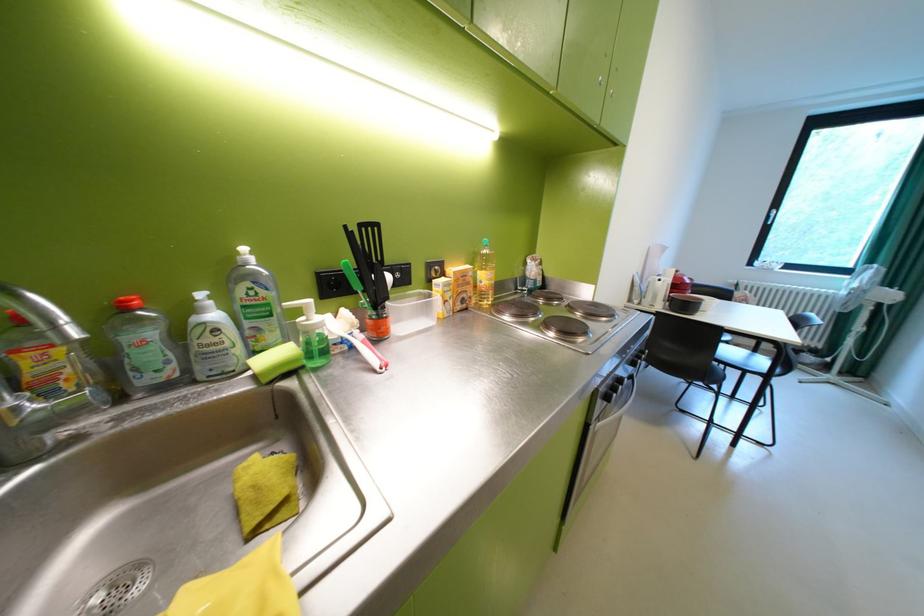
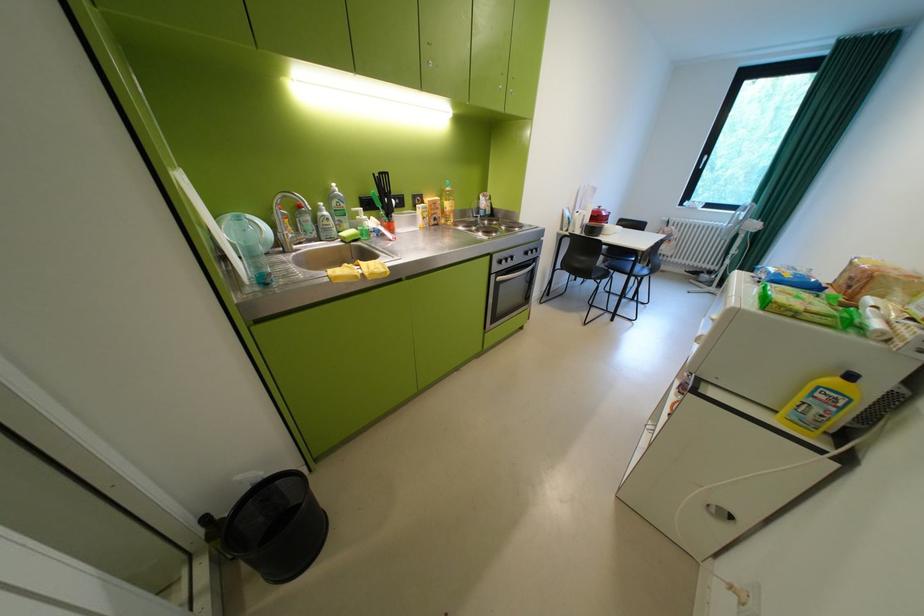
Find the pixel in the second image that matches pixel 281 301 in the first image.

(356, 209)